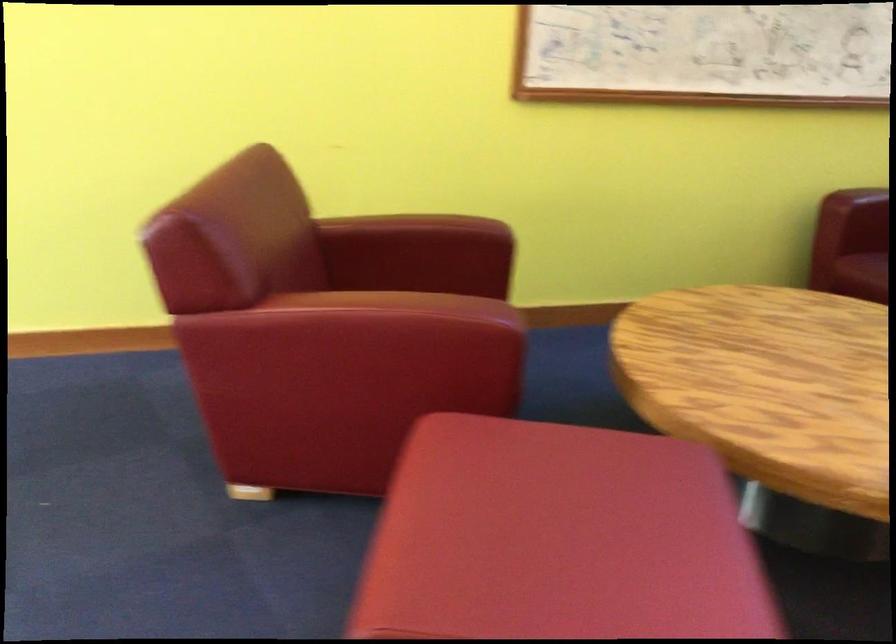
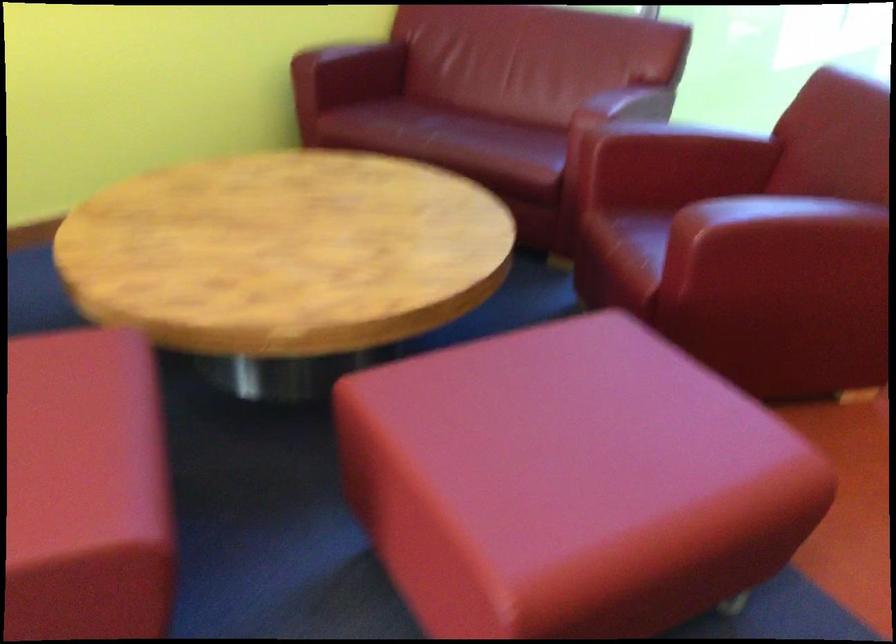
Question: What movement of the cameraman would produce the second image?

Choices:
 (A) Left
 (B) Right
 (C) Forward
 (D) Backward

Answer: (B)